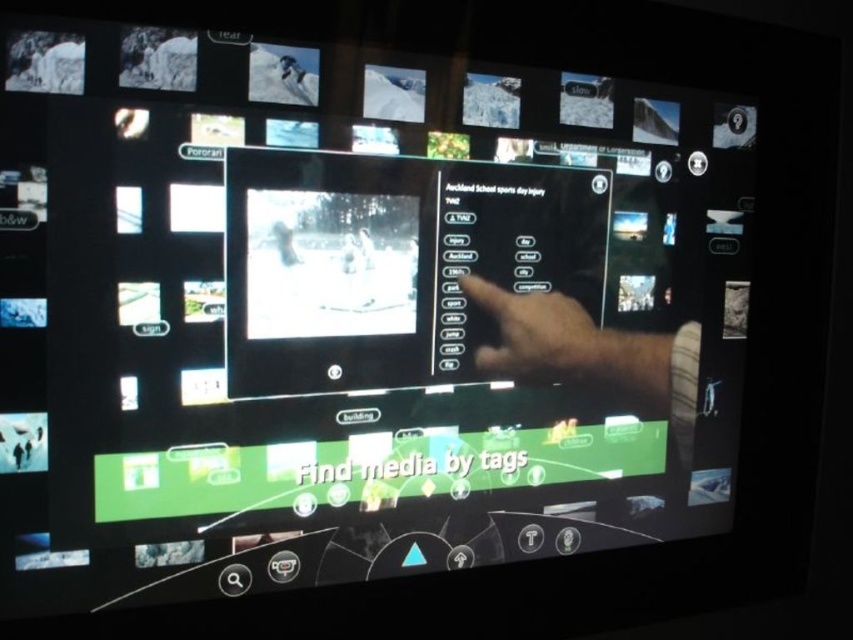
From the picture: You are a digital assistant observing a person interacting with a media management system. You notice two hands, the skinny hand at center and the skinny tan hand at center, interacting with the touchscreen. Which hand is wider?

The skinny hand at center is wider than the skinny tan hand at center as stated in the description.

You are a user trying to select an option on the touchscreen device. There are two hands shown on the screen, a skinny hand at center and a skinny tan hand at center. Which hand is closer to the main image displayed on the screen?

Both the skinny hand at center and the skinny tan hand at center are positioned at the center, so they are equally close to the main image displayed on the screen.